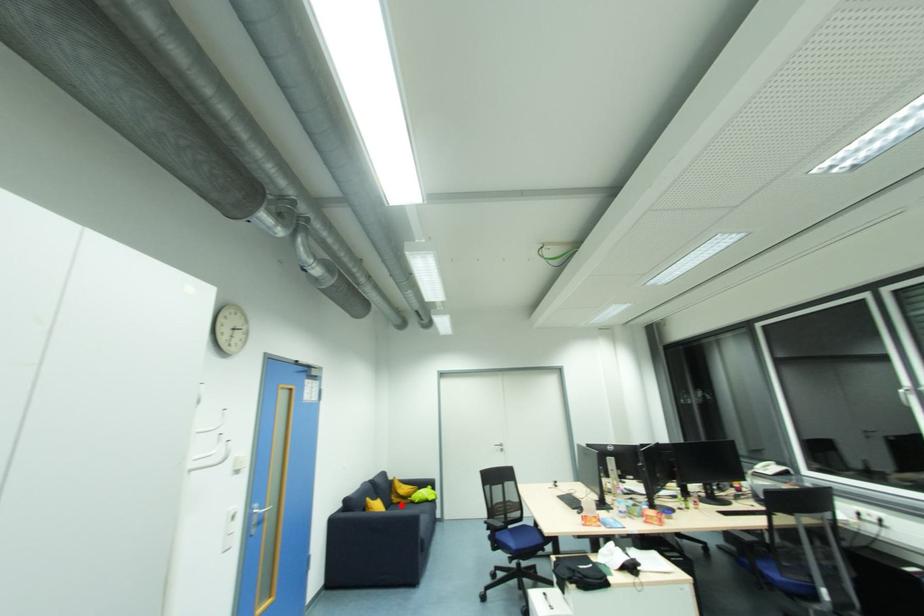
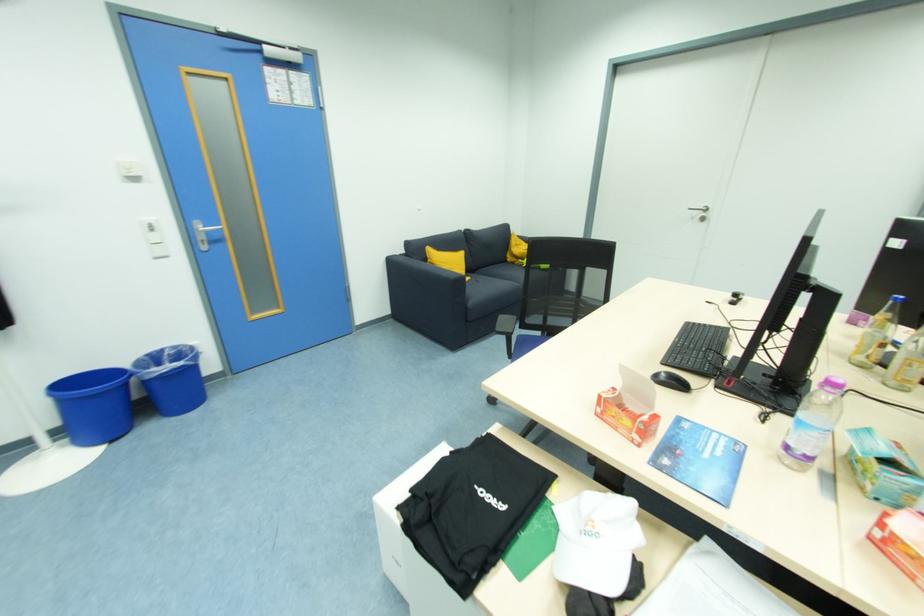
Where in the second image is the point corresponding to the highlighted location from the first image?

(516, 265)